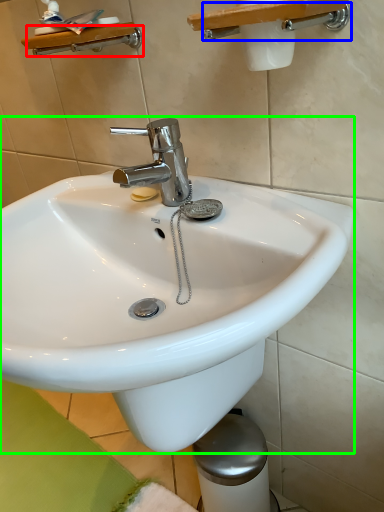
Question: Estimate the real-world distances between objects in this image. Which object is farther from shower (highlighted by a red box), shower (highlighted by a blue box) or sink (highlighted by a green box)?

Choices:
 (A) shower
 (B) sink

Answer: (B)